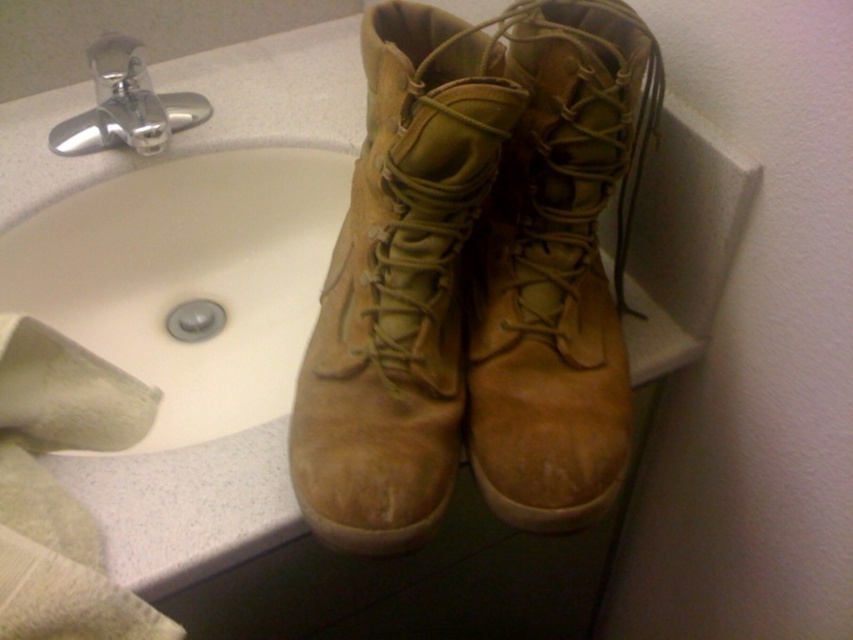
You are organizing a shoe rack and need to stack the tan suede boot at center and the tan suede boot at upper right vertically. Based on their positions in the image, which boot should be placed on top to maintain the same spatial arrangement?

The tan suede boot at center should be placed on top because in the image it is above the tan suede boot at upper right.

You are trying to locate the point at coordinates (x=556, y=266) in the bathroom scene. Which object is this point located on?

The point at coordinates (x=556, y=266) is located on the tan suede boot at upper right.

Consider the image. You are trying to take a photo of the combat boots on the bathroom sink. The camera you are using has a focus range of 20 inches. Can you focus on the point at coordinates point (479, 428) without adjusting your camera position?

The point point (479, 428) is 20.36 inches from the camera, which is slightly beyond the focus range of 20 inches. Therefore, you cannot focus on the point point (479, 428) without adjusting the camera position.